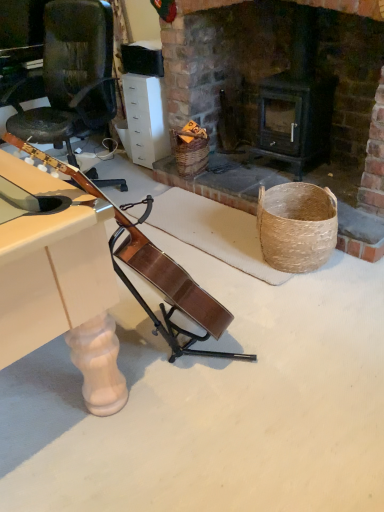
Question: Is white glossy drawer at upper center shorter than woven brown basket at center?

Choices:
 (A) no
 (B) yes

Answer: (A)

Question: Does white glossy drawer at upper center have a lesser width compared to woven brown basket at center?

Choices:
 (A) yes
 (B) no

Answer: (B)

Question: Is white glossy drawer at upper center turned away from woven brown basket at center?

Choices:
 (A) no
 (B) yes

Answer: (A)

Question: Is white glossy drawer at upper center closer to the viewer compared to woven brown basket at center?

Choices:
 (A) yes
 (B) no

Answer: (B)

Question: Is white glossy drawer at upper center with woven brown basket at center?

Choices:
 (A) no
 (B) yes

Answer: (A)

Question: Is white glossy drawer at upper center not within woven brown basket at center?

Choices:
 (A) yes
 (B) no

Answer: (A)

Question: Is woven brown basket at center oriented away from white glossy drawer at upper center?

Choices:
 (A) no
 (B) yes

Answer: (A)

Question: Is woven brown basket at center not close to white glossy drawer at upper center?

Choices:
 (A) no
 (B) yes

Answer: (A)

Question: Is woven brown basket at center positioned in front of white glossy drawer at upper center?

Choices:
 (A) yes
 (B) no

Answer: (A)

Question: Would you say woven brown basket at center contains white glossy drawer at upper center?

Choices:
 (A) yes
 (B) no

Answer: (B)

Question: From a real-world perspective, is woven brown basket at center positioned over white glossy drawer at upper center based on gravity?

Choices:
 (A) yes
 (B) no

Answer: (B)

Question: Does woven brown basket at center appear on the right side of white glossy drawer at upper center?

Choices:
 (A) no
 (B) yes

Answer: (B)

Question: From a real-world perspective, is white glossy drawer at upper center positioned above or below woven brown basket at center?

Choices:
 (A) above
 (B) below

Answer: (A)